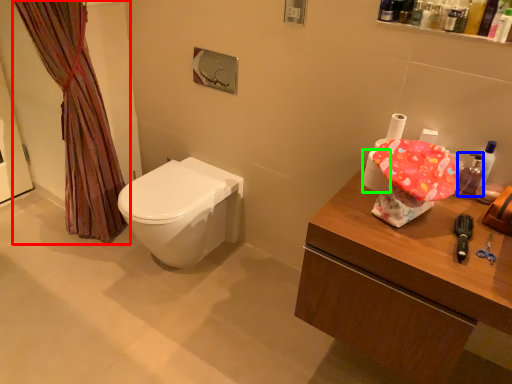
Question: Which is nearer to the curtain (highlighted by a red box)? mouthwash (highlighted by a blue box) or toilet paper (highlighted by a green box).

Choices:
 (A) mouthwash
 (B) toilet paper

Answer: (B)